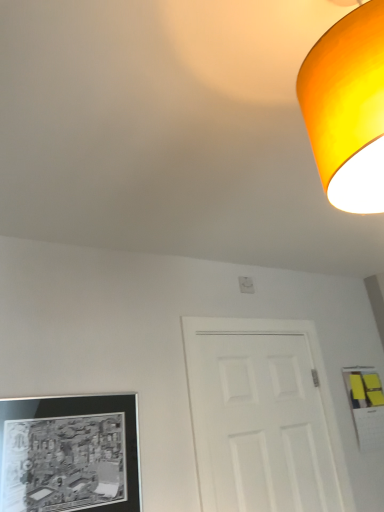
Question: Is black matte picture frame at lower left directly adjacent to white matte door at center?

Choices:
 (A) no
 (B) yes

Answer: (A)

Question: Can you confirm if black matte picture frame at lower left is bigger than white matte door at center?

Choices:
 (A) yes
 (B) no

Answer: (B)

Question: Could you tell me if black matte picture frame at lower left is facing white matte door at center?

Choices:
 (A) yes
 (B) no

Answer: (B)

Question: From a real-world perspective, is black matte picture frame at lower left positioned over white matte door at center based on gravity?

Choices:
 (A) yes
 (B) no

Answer: (B)

Question: Does black matte picture frame at lower left appear on the left side of white matte door at center?

Choices:
 (A) yes
 (B) no

Answer: (A)

Question: Is black matte picture frame at lower left to the right of white matte door at center from the viewer's perspective?

Choices:
 (A) yes
 (B) no

Answer: (B)

Question: Does matte orange lampshade at upper right have a greater width compared to white matte door at center?

Choices:
 (A) yes
 (B) no

Answer: (A)

Question: Is matte orange lampshade at upper right at the left side of white matte door at center?

Choices:
 (A) no
 (B) yes

Answer: (B)

Question: From a real-world perspective, is matte orange lampshade at upper right over white matte door at center?

Choices:
 (A) yes
 (B) no

Answer: (A)

Question: From the image's perspective, is matte orange lampshade at upper right over white matte door at center?

Choices:
 (A) no
 (B) yes

Answer: (B)

Question: Is matte orange lampshade at upper right with white matte door at center?

Choices:
 (A) yes
 (B) no

Answer: (B)

Question: Is matte orange lampshade at upper right positioned beyond the bounds of white matte door at center?

Choices:
 (A) no
 (B) yes

Answer: (B)

Question: Is black matte picture frame at lower left oriented away from matte orange lampshade at upper right?

Choices:
 (A) yes
 (B) no

Answer: (B)